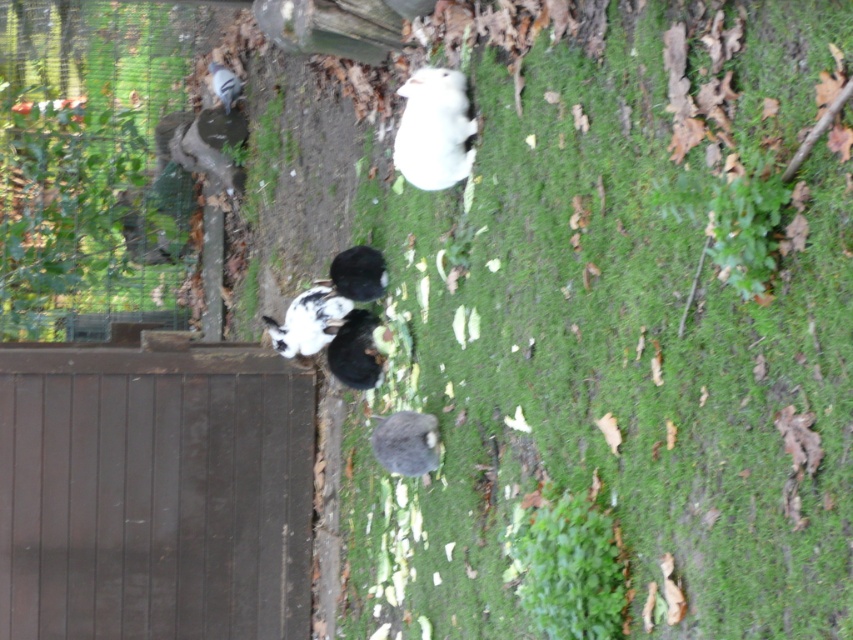
Can you confirm if white fluffy rabbit at upper center is positioned to the left of white fur rabbit at upper left?

No, white fluffy rabbit at upper center is not to the left of white fur rabbit at upper left.

Is the position of white fluffy rabbit at upper center more distant than that of white fur rabbit at upper left?

No.

Describe the element at coordinates (433, 129) in the screenshot. The image size is (853, 640). I see `white fluffy rabbit at upper center` at that location.

The height and width of the screenshot is (640, 853). In order to click on white fluffy rabbit at upper center in this screenshot , I will do `click(433, 129)`.

Describe the element at coordinates (433, 129) in the screenshot. I see `white fluffy rabbit at upper center` at that location.

The height and width of the screenshot is (640, 853). I want to click on white fluffy rabbit at upper center, so coord(433,129).

Does white fluffy rabbit at center lie behind fluffy black and white rabbit at center?

Yes, it is behind fluffy black and white rabbit at center.

Between point (294, 339) and point (358, 314), which one is positioned behind?

The point (294, 339) is behind.

In order to click on white fluffy rabbit at center in this screenshot , I will do `click(308, 321)`.